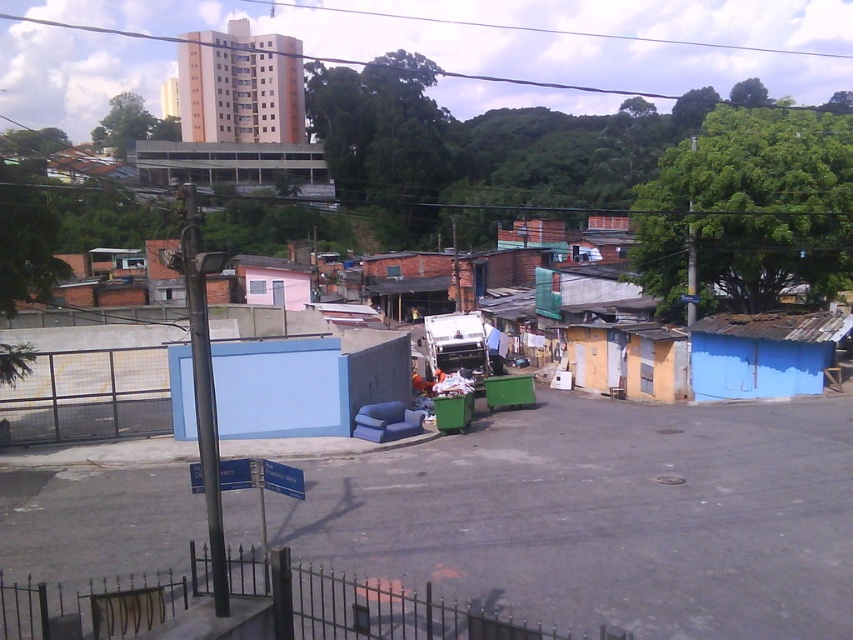
You are a delivery person trying to locate a blue corrugated metal hut in the image. The coordinates provided are point A at (762, 353). Based on the scene description, can you identify the location of the blue corrugated metal hut?

The point A at (762, 353) indicates the location of the blue corrugated metal hut at right.

You are a delivery drone with a maximum flight range of 30 meters. You need to deliver a package from the beige concrete building at upper left to the green corrugated metal building at upper center. Can you complete the delivery without needing a recharge?

The distance between the beige concrete building at upper left and the green corrugated metal building at upper center is 33.96 meters. Since the drone can only fly 30 meters before needing a recharge, it cannot complete the delivery without recharging.